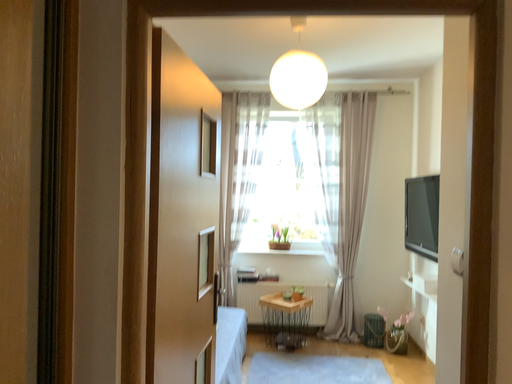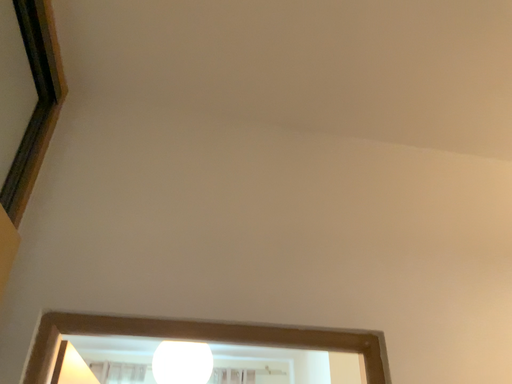
Question: Which way did the camera rotate in the video?

Choices:
 (A) rotated downward
 (B) rotated upward

Answer: (B)